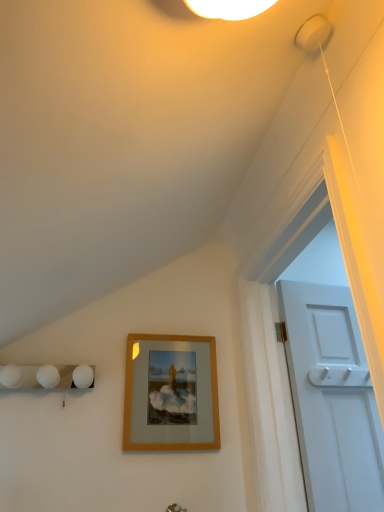
Question: Is silver metallic door handle at lower center inside the boundaries of wooden frame at center, or outside?

Choices:
 (A) inside
 (B) outside

Answer: (B)

Question: Based on their sizes in the image, would you say silver metallic door handle at lower center is bigger or smaller than wooden frame at center?

Choices:
 (A) big
 (B) small

Answer: (B)

Question: From the image's perspective, is silver metallic door handle at lower center positioned above or below wooden frame at center?

Choices:
 (A) above
 (B) below

Answer: (B)

Question: From a real-world perspective, is wooden frame at center above or below silver metallic door handle at lower center?

Choices:
 (A) above
 (B) below

Answer: (A)

Question: In terms of height, does wooden frame at center look taller or shorter compared to silver metallic door handle at lower center?

Choices:
 (A) tall
 (B) short

Answer: (A)

Question: Considering the positions of point (215, 428) and point (168, 505), is point (215, 428) closer or farther from the camera than point (168, 505)?

Choices:
 (A) farther
 (B) closer

Answer: (A)

Question: Is wooden frame at center wider or thinner than silver metallic door handle at lower center?

Choices:
 (A) thin
 (B) wide

Answer: (A)